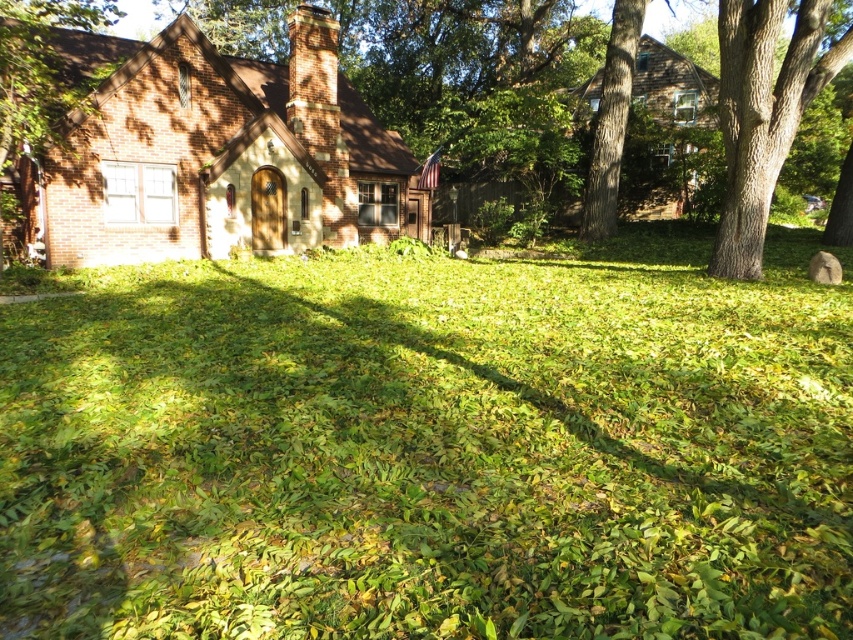
Question: Considering the real-world distances, which object is closest to the brick wall at left?

Choices:
 (A) brown rough bark tree at upper right
 (B) green rough bark tree at right
 (C) green leafy grass at center

Answer: (C)

Question: Does brick wall at left appear over brown rough bark tree at upper right?

Choices:
 (A) yes
 (B) no

Answer: (A)

Question: Is the position of green leafy grass at center more distant than that of brick wall at left?

Choices:
 (A) no
 (B) yes

Answer: (A)

Question: Estimate the real-world distances between objects in this image. Which object is farther from the brown rough bark tree at upper right?

Choices:
 (A) brick wall at left
 (B) green rough bark tree at right

Answer: (A)

Question: Can you confirm if green rough bark tree at right is positioned below brick wall at left?

Choices:
 (A) yes
 (B) no

Answer: (A)

Question: Which is farther from the brick wall at left?

Choices:
 (A) green leafy grass at center
 (B) brown rough bark tree at upper right
 (C) green rough bark tree at right

Answer: (C)